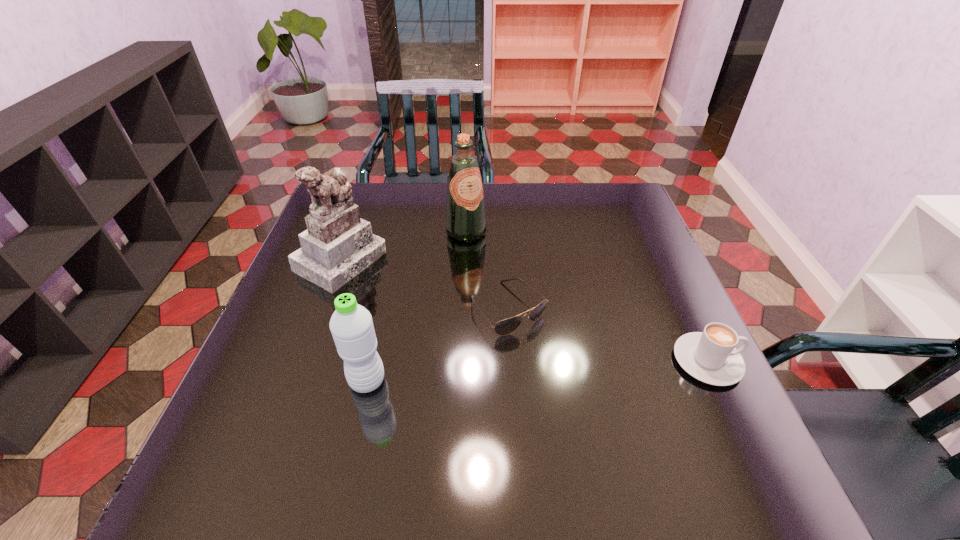
Locate an element on the screen. free space on the desktop that is between the water bottle and the rightmost object and is positioned on the front-facing side of the olive oil is located at coordinates (579, 369).

You are a GUI agent. You are given a task and a screenshot of the screen. Output one action in this format:
    pyautogui.click(x=<x>, y=<y>)
    Task: Click on the vacant space on the desktop that is between the water bottle and the second shortest object and is positioned on the front-facing side of the sunglasses
    This screenshot has width=960, height=540.
    Given the screenshot: What is the action you would take?
    pyautogui.click(x=564, y=369)

This screenshot has width=960, height=540. I want to click on vacant spot on the desktop that is between the third tallest object and the fourth tallest object and is positioned on the front-facing side of the figurine, so click(548, 370).